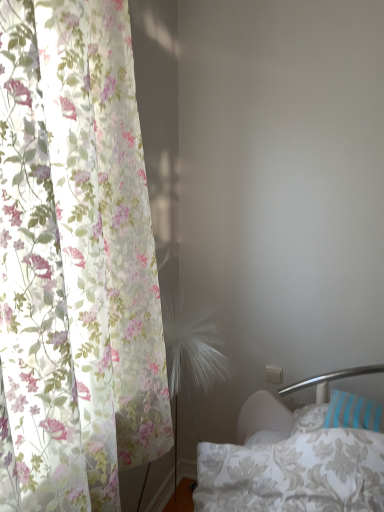
The width and height of the screenshot is (384, 512). Describe the element at coordinates (75, 261) in the screenshot. I see `floral fabric curtain at left` at that location.

This screenshot has width=384, height=512. In order to click on floral fabric curtain at left in this screenshot , I will do `click(75, 261)`.

This screenshot has height=512, width=384. Identify the location of floral fabric curtain at left. (75, 261).